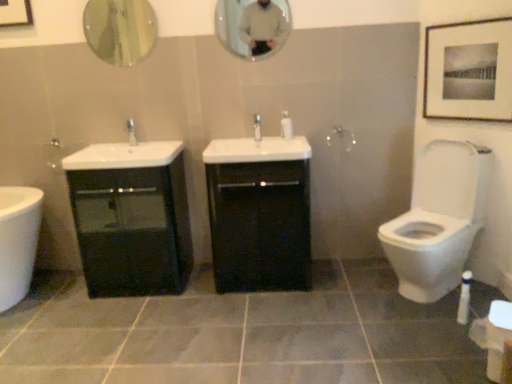
Where is `free location to the right of black glossy cabinet at center, the first bathroom cabinet when ordered from right to left`? Image resolution: width=512 pixels, height=384 pixels. free location to the right of black glossy cabinet at center, the first bathroom cabinet when ordered from right to left is located at coordinates click(x=339, y=279).